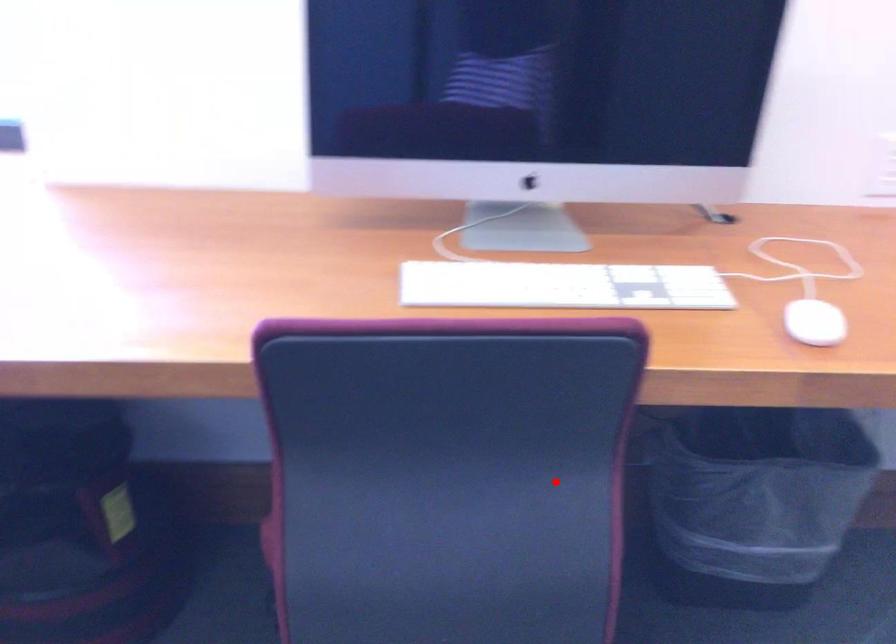
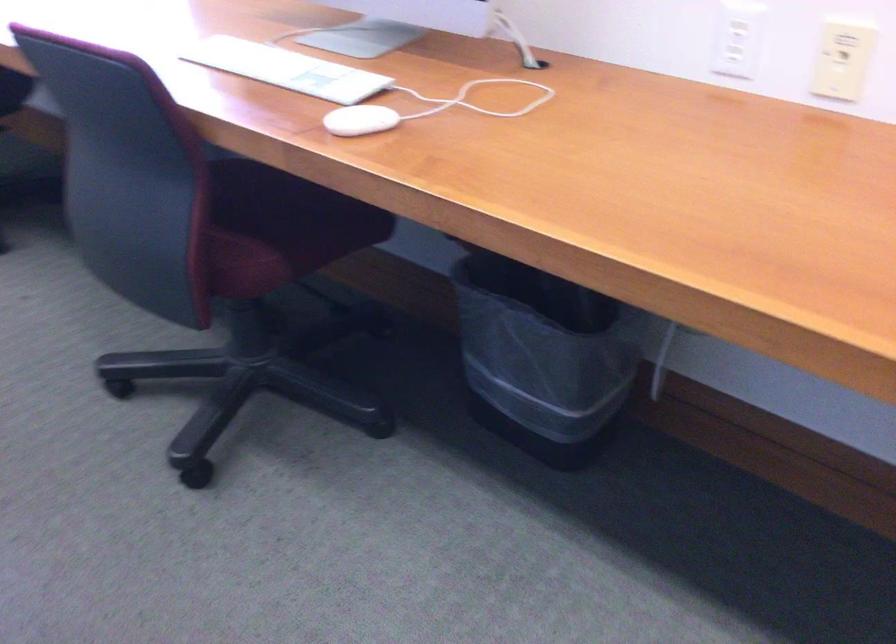
Find the pixel in the second image that matches the highlighted location in the first image.

(273, 228)